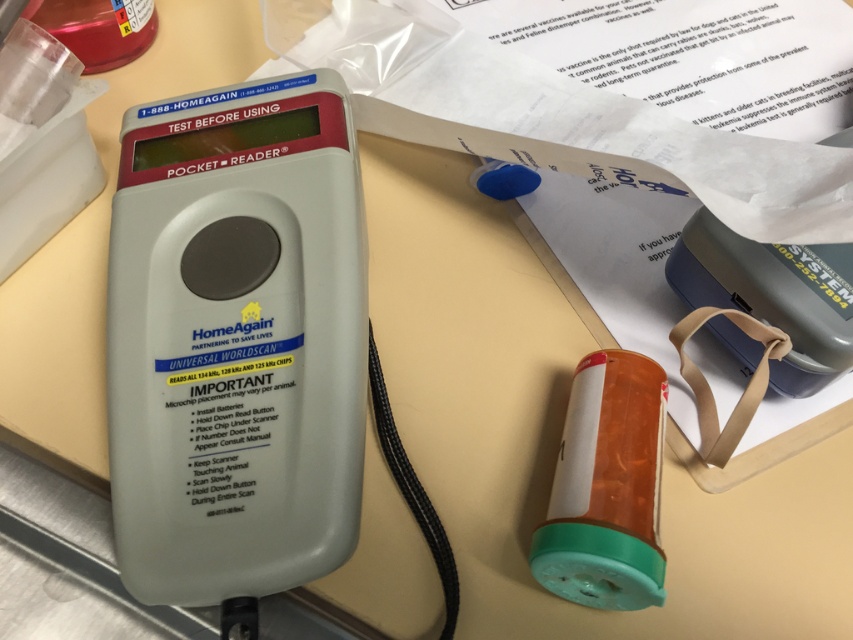
You are a nurse preparing to administer medication. You have a white plastic pocket reader at center and a translucent plastic bottle at upper left on the table. Which object is taller?

The white plastic pocket reader at center is taller than the translucent plastic bottle at upper left.

In the scene shown: You are holding the HomeAgain Pocket Reader and need to scan a microchip. The device requires that you hold it exactly 60 centimeters away from the microchip. Based on the scene, can you determine if the distance between the Pocket Reader and the microchip at point [584,364] is within the required range?

The point [584,364] is 62.96 centimeters from the viewer. Since the required distance is exactly 60 centimeters, the current distance is 2.96 centimeters too far. You need to move the Pocket Reader closer to reduce the distance by approximately 3 centimeters to meet the requirement.